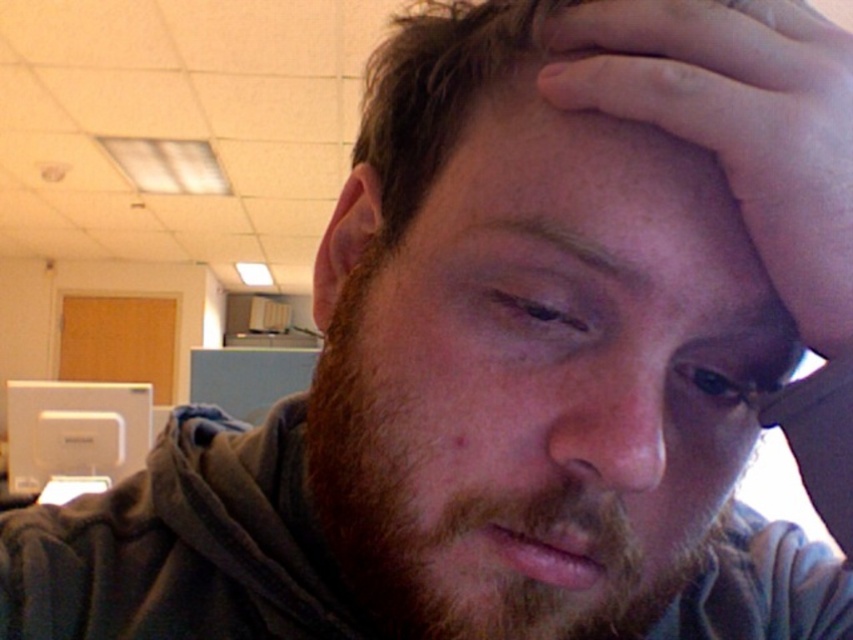
Question: Is skinny flesh-toned hand at upper right smaller than white plastic monitor at lower left?

Choices:
 (A) yes
 (B) no

Answer: (A)

Question: Can you confirm if skinny flesh-toned hand at upper right is positioned to the left of white plastic monitor at lower left?

Choices:
 (A) no
 (B) yes

Answer: (A)

Question: Which point is farther from the camera taking this photo?

Choices:
 (A) (50, 388)
 (B) (666, 116)

Answer: (A)

Question: Which point is closer to the camera?

Choices:
 (A) white plastic monitor at lower left
 (B) skinny flesh-toned hand at upper right

Answer: (B)

Question: Does skinny flesh-toned hand at upper right appear under white plastic monitor at lower left?

Choices:
 (A) no
 (B) yes

Answer: (A)